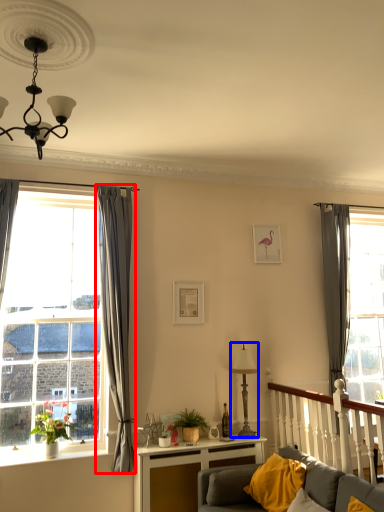
Question: Which object appears farthest to the camera in this image, curtain (highlighted by a red box) or lamp (highlighted by a blue box)?

Choices:
 (A) curtain
 (B) lamp

Answer: (B)